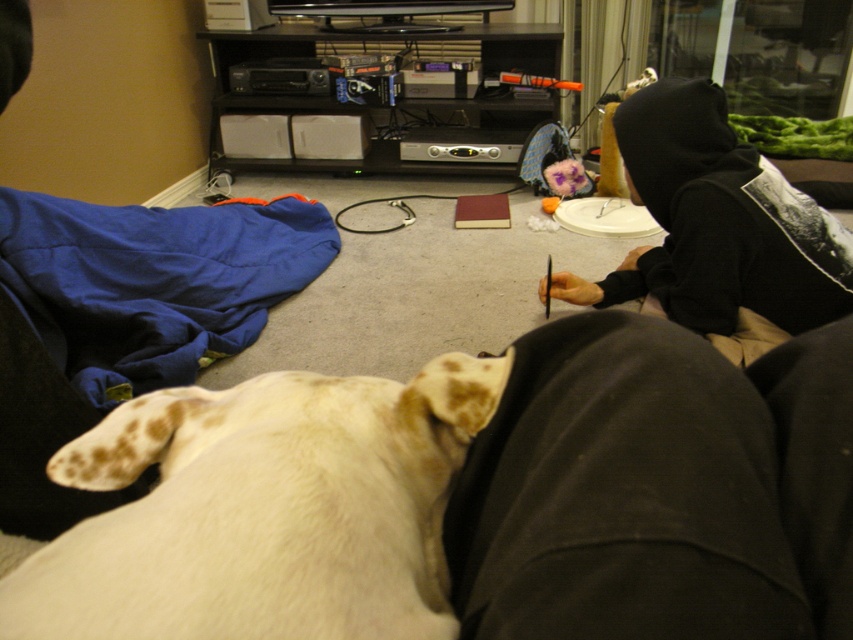
Question: Which point is farther to the camera?

Choices:
 (A) black hoodie at upper right
 (B) white fur dog at lower left

Answer: (A)

Question: Can you confirm if white fur dog at lower left is positioned to the right of black hoodie at upper right?

Choices:
 (A) no
 (B) yes

Answer: (A)

Question: Which of the following is the farthest from the observer?

Choices:
 (A) black hoodie at upper right
 (B) white fur dog at lower left

Answer: (A)

Question: Is white fur dog at lower left positioned behind black hoodie at upper right?

Choices:
 (A) no
 (B) yes

Answer: (A)

Question: Does white fur dog at lower left have a greater width compared to black hoodie at upper right?

Choices:
 (A) no
 (B) yes

Answer: (A)